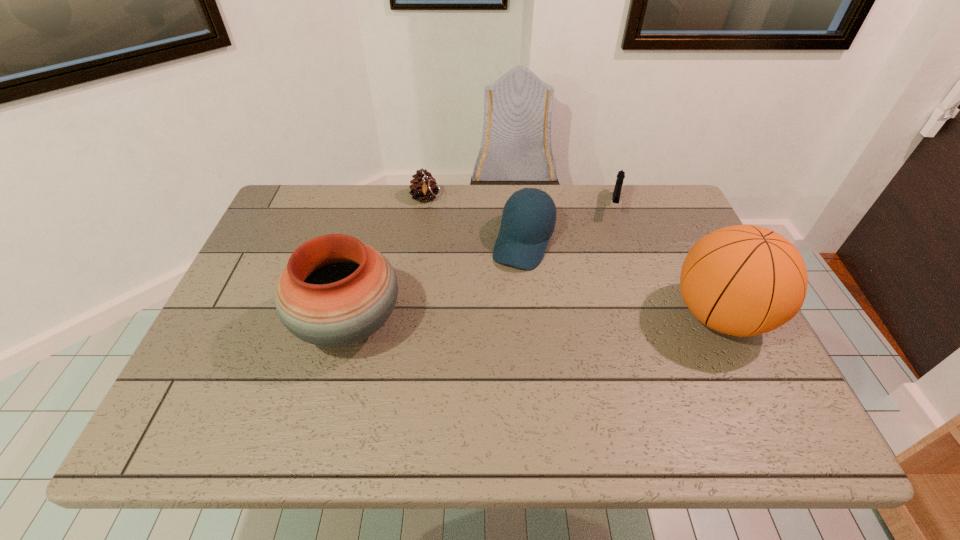
Locate an element on the screen. pottery is located at coordinates (335, 291).

Image resolution: width=960 pixels, height=540 pixels. I want to click on the rightmost object, so click(743, 280).

This screenshot has width=960, height=540. I want to click on the third tallest object, so click(x=524, y=234).

Where is `the third object from right to left`? This screenshot has width=960, height=540. the third object from right to left is located at coordinates (524, 234).

Locate an element on the screen. pinecone is located at coordinates (423, 187).

The width and height of the screenshot is (960, 540). What are the coordinates of `the second object from right to left` in the screenshot? It's located at (621, 174).

Where is `free space located 0.080m on the left of the pottery`? This screenshot has height=540, width=960. free space located 0.080m on the left of the pottery is located at coordinates (261, 325).

Find the location of `vacant space located 0.340m on the back of the rightmost object`. vacant space located 0.340m on the back of the rightmost object is located at coordinates (663, 201).

You are a GUI agent. You are given a task and a screenshot of the screen. Output one action in this format:
    pyautogui.click(x=<x>, y=<y>)
    Task: Click on the vacant point located on the front-facing side of the third object from right to left
    
    Given the screenshot: What is the action you would take?
    pyautogui.click(x=480, y=354)

This screenshot has width=960, height=540. Identify the location of vacant space situated 0.350m on the front-facing side of the third object from right to left. (468, 380).